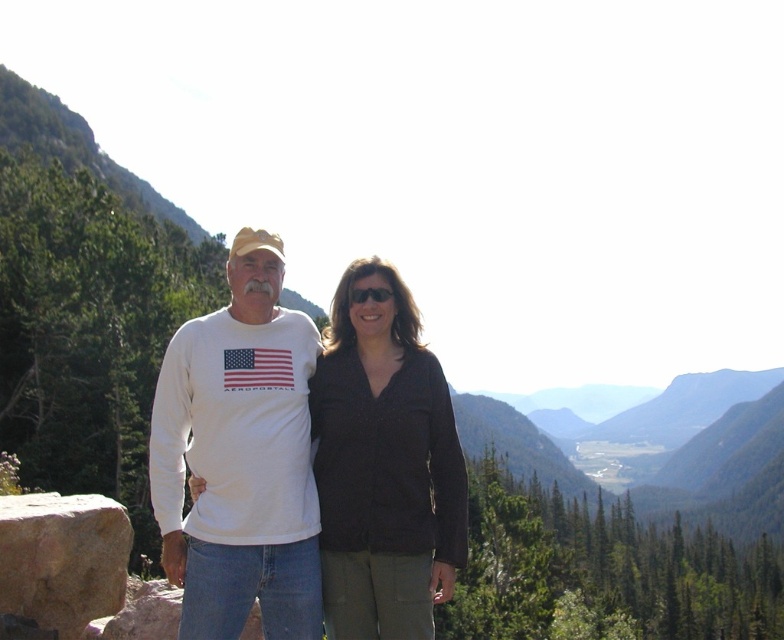
You are standing at the point marked by the coordinates point (x=343, y=392) in the image. You want to walk straight towards the mountain range in the background. How far will you have to walk before you reach the base of the mountains?

The point (x=343, y=392) is 14.81 meters from the viewer, so you would need to walk approximately 14.81 meters to reach the base of the mountains.

You are standing in front of the two people in the image and want to place a small flag at the point closer to you between point (438, 588) and point (57, 582). Which point should you choose?

Point (438, 588) is closer to the viewer than point (57, 582), so you should choose point (438, 588) to place the small flag.